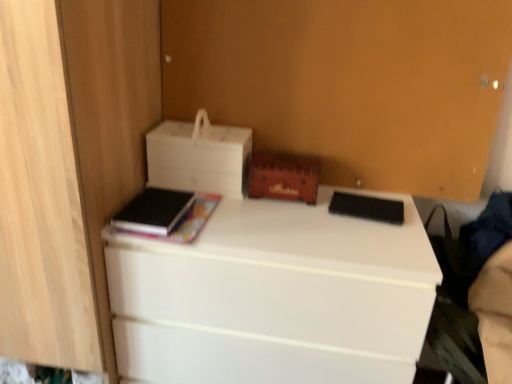
Locate an element on the screen. This screenshot has height=384, width=512. free space in front of white matte printer at upper left is located at coordinates (226, 217).